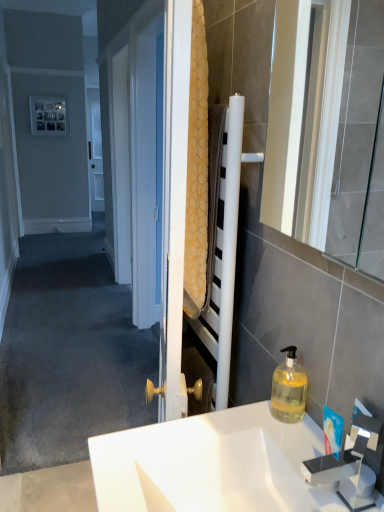
Identify the location of white glossy sink at center. This screenshot has height=512, width=384. (211, 465).

What do you see at coordinates (49, 115) in the screenshot? The width and height of the screenshot is (384, 512). I see `metallic silver picture frame at upper left` at bounding box center [49, 115].

This screenshot has width=384, height=512. In order to click on translucent plastic faucet at upper right in this screenshot , I will do `click(343, 473)`.

Could yellow textured towel at center be considered to be inside white glossy mirror at right?

Definitely not — yellow textured towel at center is not inside white glossy mirror at right.

Based on the photo, from the image's perspective, relative to yellow textured towel at center, is white glossy mirror at right above or below?

From the image's perspective, white glossy mirror at right appears below yellow textured towel at center.

Can you see white glossy mirror at right touching yellow textured towel at center?

white glossy mirror at right is not next to yellow textured towel at center, and they're not touching.

Find the location of `faucet that appears on the right of metallic silver picture frame at upper left`. faucet that appears on the right of metallic silver picture frame at upper left is located at coordinates (343, 473).

Which is in front, point (356, 449) or point (64, 126)?

The point (356, 449) is in front.

In the scene shown: Is translucent plastic faucet at upper right positioned with its back to metallic silver picture frame at upper left?

No.

How many degrees apart are the facing directions of translucent plastic faucet at upper right and metallic silver picture frame at upper left?

89.4 degrees.

What are the coordinates of `bath towel that is on the left side of translucent yellow liquid at lower right` in the screenshot? It's located at (197, 172).

Is yellow textured towel at center surrounded by translucent yellow liquid at lower right?

No, translucent yellow liquid at lower right does not contain yellow textured towel at center.

Considering the positions of objects translucent yellow liquid at lower right and yellow textured towel at center in the image provided, who is more to the right, translucent yellow liquid at lower right or yellow textured towel at center?

Positioned to the right is translucent yellow liquid at lower right.

Considering their positions, is metallic silver picture frame at upper left located in front of or behind yellow textured towel at center?

Clearly, metallic silver picture frame at upper left is behind yellow textured towel at center.

From the image's perspective, which one is positioned higher, metallic silver picture frame at upper left or yellow textured towel at center?

metallic silver picture frame at upper left appears higher in the image.

I want to click on picture frame behind the yellow textured towel at center, so click(49, 115).

Are metallic silver picture frame at upper left and yellow textured towel at center far apart?

That's right, there is a large distance between metallic silver picture frame at upper left and yellow textured towel at center.

Is point (282, 379) closer or farther from the camera than point (156, 432)?

Clearly, point (282, 379) is more distant from the camera than point (156, 432).

From the image's perspective, is translucent yellow liquid at lower right under white glossy sink at center?

No, from the image's perspective, translucent yellow liquid at lower right is not below white glossy sink at center.

From a real-world perspective, which object rests below the other?

white glossy sink at center is physically lower.

How different are the orientations of translucent yellow liquid at lower right and white glossy sink at center in degrees?

There is a 0.99-degree angle between the facing directions of translucent yellow liquid at lower right and white glossy sink at center.

Which of these two, translucent plastic faucet at upper right or translucent yellow liquid at lower right, stands shorter?

translucent yellow liquid at lower right.

Is translucent plastic faucet at upper right far from translucent yellow liquid at lower right?

Actually, translucent plastic faucet at upper right and translucent yellow liquid at lower right are a little close together.

Does translucent plastic faucet at upper right appear on the left side of translucent yellow liquid at lower right?

No.

Is translucent plastic faucet at upper right inside or outside of translucent yellow liquid at lower right?

translucent plastic faucet at upper right cannot be found inside translucent yellow liquid at lower right.

Considering the relative sizes of white glossy sink at center and translucent yellow liquid at lower right in the image provided, is white glossy sink at center taller than translucent yellow liquid at lower right?

In fact, white glossy sink at center may be shorter than translucent yellow liquid at lower right.

Find the location of a particular element. bottle above the white glossy sink at center (from the image's perspective) is located at coordinates (289, 389).

Is white glossy sink at center in contact with translucent yellow liquid at lower right?

No, white glossy sink at center is not next to translucent yellow liquid at lower right.

Considering the relative positions of white glossy sink at center and translucent yellow liquid at lower right in the image provided, is white glossy sink at center in front of translucent yellow liquid at lower right?

Yes, it is in front of translucent yellow liquid at lower right.

Where is `bath towel lying above the white glossy mirror at right (from the image's perspective)`? Image resolution: width=384 pixels, height=512 pixels. bath towel lying above the white glossy mirror at right (from the image's perspective) is located at coordinates (197, 172).

Find the location of `faucet on the right of metallic silver picture frame at upper left`. faucet on the right of metallic silver picture frame at upper left is located at coordinates (343, 473).

Which object lies further to the anchor point white glossy sink at center, translucent plastic faucet at upper right or white glossy mirror at right?

The object further to white glossy sink at center is white glossy mirror at right.

When comparing their distances from metallic silver picture frame at upper left, does white glossy sink at center or translucent yellow liquid at lower right seem further?

Based on the image, white glossy sink at center appears to be further to metallic silver picture frame at upper left.

Considering their positions, is white glossy sink at center positioned closer to white glossy mirror at right than yellow textured towel at center?

The object closer to white glossy mirror at right is yellow textured towel at center.

Looking at this image, from the image, which object appears to be farther from white glossy mirror at right, metallic silver picture frame at upper left or translucent yellow liquid at lower right?

metallic silver picture frame at upper left.

Looking at the image, which one is located closer to translucent plastic faucet at upper right, translucent yellow liquid at lower right or yellow textured towel at center?

translucent yellow liquid at lower right.

Based on the photo, from the image, which object appears to be nearer to metallic silver picture frame at upper left, translucent plastic faucet at upper right or white glossy mirror at right?

Among the two, white glossy mirror at right is located nearer to metallic silver picture frame at upper left.

Considering their positions, is white glossy sink at center positioned further to white glossy mirror at right than translucent yellow liquid at lower right?

white glossy sink at center.

From the image, which object appears to be nearer to translucent yellow liquid at lower right, yellow textured towel at center or translucent plastic faucet at upper right?

translucent plastic faucet at upper right is positioned closer to the anchor translucent yellow liquid at lower right.

Identify the location of bath towel positioned between white glossy mirror at right and translucent yellow liquid at lower right from near to far. (197, 172).

The width and height of the screenshot is (384, 512). I want to click on bottle located between white glossy sink at center and metallic silver picture frame at upper left in the depth direction, so click(289, 389).

Where is `faucet between white glossy sink at center and metallic silver picture frame at upper left along the z-axis`? This screenshot has height=512, width=384. faucet between white glossy sink at center and metallic silver picture frame at upper left along the z-axis is located at coordinates (343, 473).

This screenshot has width=384, height=512. Identify the location of faucet between yellow textured towel at center and white glossy sink at center in the up-down direction. (343, 473).